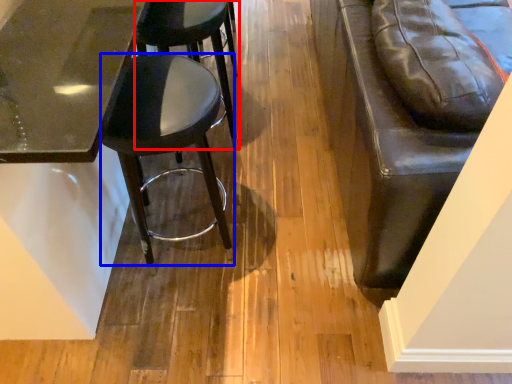
Question: Which object is closer to the camera taking this photo, stool (highlighted by a red box) or stool (highlighted by a blue box)?

Choices:
 (A) stool
 (B) stool

Answer: (B)